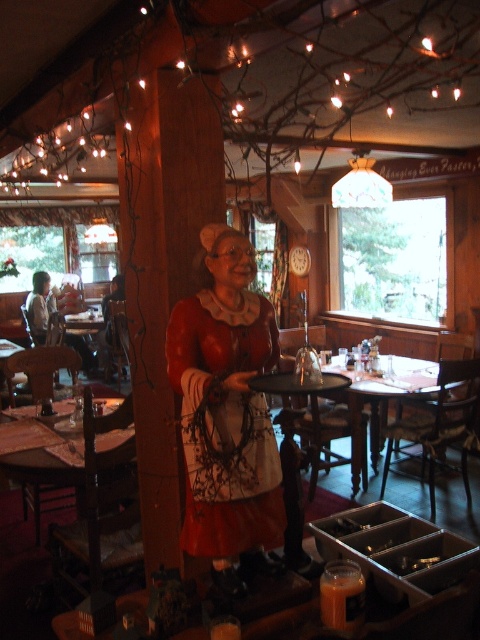
You are a customer in this rustic restaurant and want to place your phone on the closest surface. You have the matte red dress at center and the wooden table at center in view. Which surface is closer to you?

The matte red dress at center is 8.13 feet away from the wooden table at center. Since the wooden table at center is typically a flat surface for placing items, you should place your phone on the wooden table at center.

You are a customer in the restaurant and want to place your phone on the wooden table at lower left. However, there is a statue with a matte red dress at center nearby. Is the statue taller than the table?

The matte red dress at center is taller than wooden table at lower left, so yes, the statue is taller than the table.